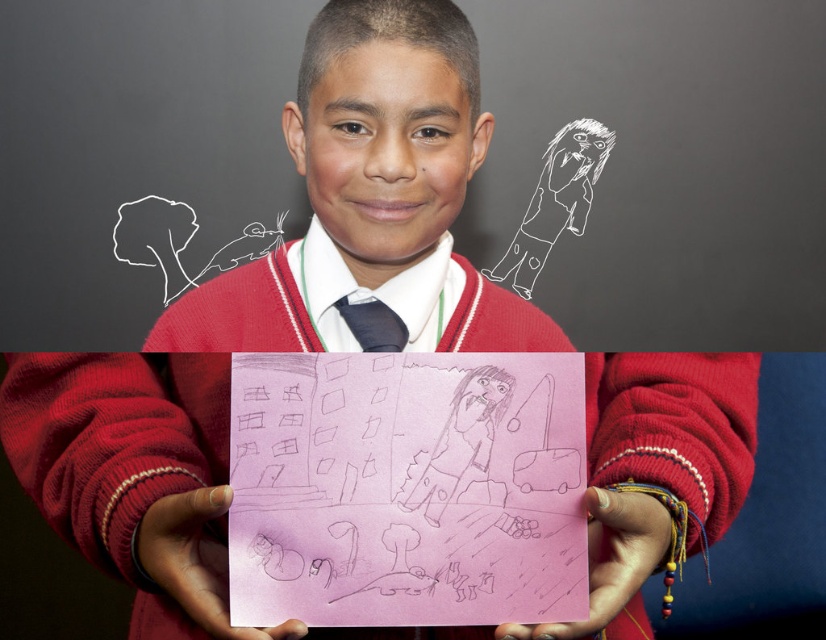
Between smooth skin hand at center and black satin tie at center, which one is positioned lower?

smooth skin hand at center

Does smooth skin hand at center have a greater width compared to black satin tie at center?

Correct, the width of smooth skin hand at center exceeds that of black satin tie at center.

Which is behind, point (608, 616) or point (371, 308)?

Point (371, 308)

Identify the location of smooth skin hand at center. The width and height of the screenshot is (826, 640). (610, 560).

Is pink paper at center thinner than black satin tie at center?

Incorrect, pink paper at center's width is not less than black satin tie at center's.

Looking at this image, between pink paper at center and black satin tie at center, which one appears on the left side from the viewer's perspective?

pink paper at center

Is point (235, 632) positioned before point (406, 337)?

That is True.

In order to click on pink paper at center in this screenshot , I will do `click(197, 561)`.

Is pink paper at center bigger than smooth skin hand at center?

Correct, pink paper at center is larger in size than smooth skin hand at center.

Between pink paper at center and smooth skin hand at center, which one is positioned lower?

Positioned lower is pink paper at center.

Locate an element on the screen. This screenshot has height=640, width=826. pink paper at center is located at coordinates (197, 561).

Image resolution: width=826 pixels, height=640 pixels. Identify the location of pink paper at center. (197, 561).